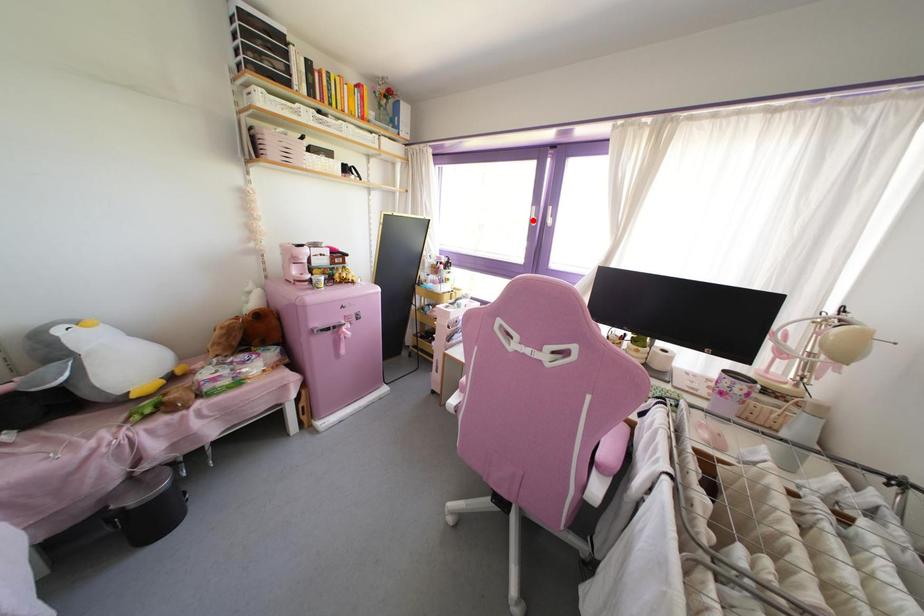
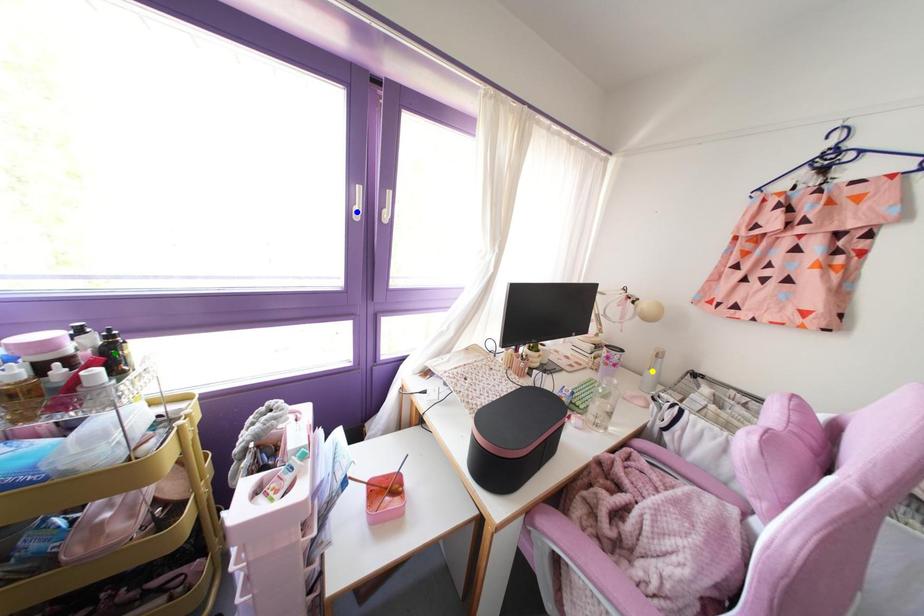
Question: I am providing you with two images of the same scene from different viewpoints. A red point is marked on the first image. You are given multiple points on the second image. Can you choose the point in image 2 that corresponds to the point in image 1?

Choices:
 (A) yellow point
 (B) blue point
 (C) green point

Answer: (B)